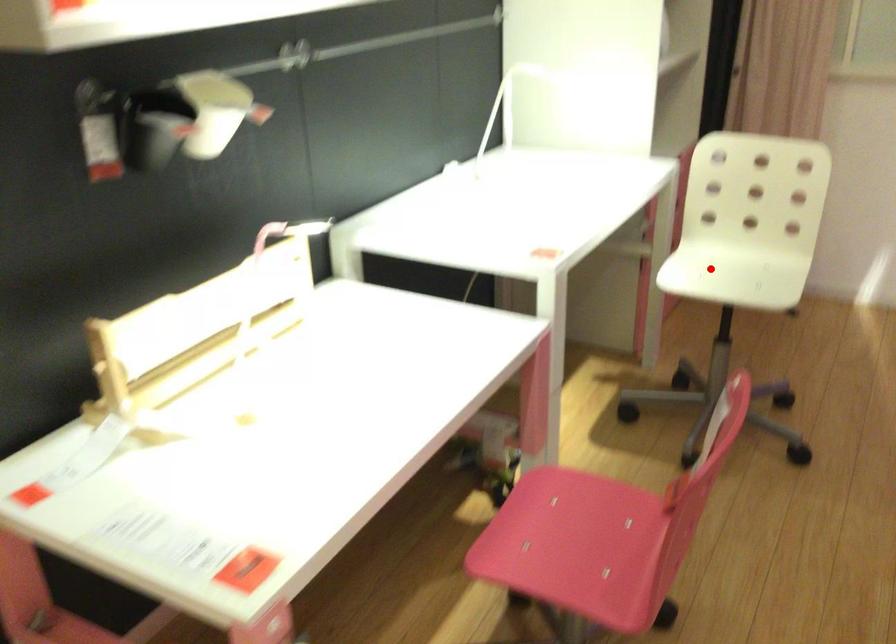
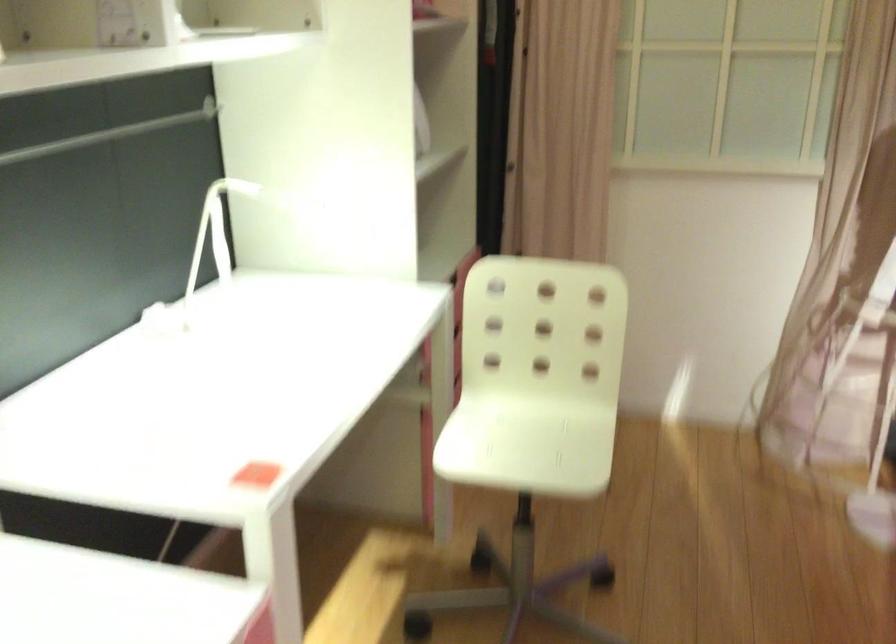
Question: I am providing you with two images of the same scene from different viewpoints. A red point is shown in image1. For the corresponding object point in image2, is it positioned nearer or farther from the camera?

Choices:
 (A) Nearer
 (B) Farther

Answer: (A)